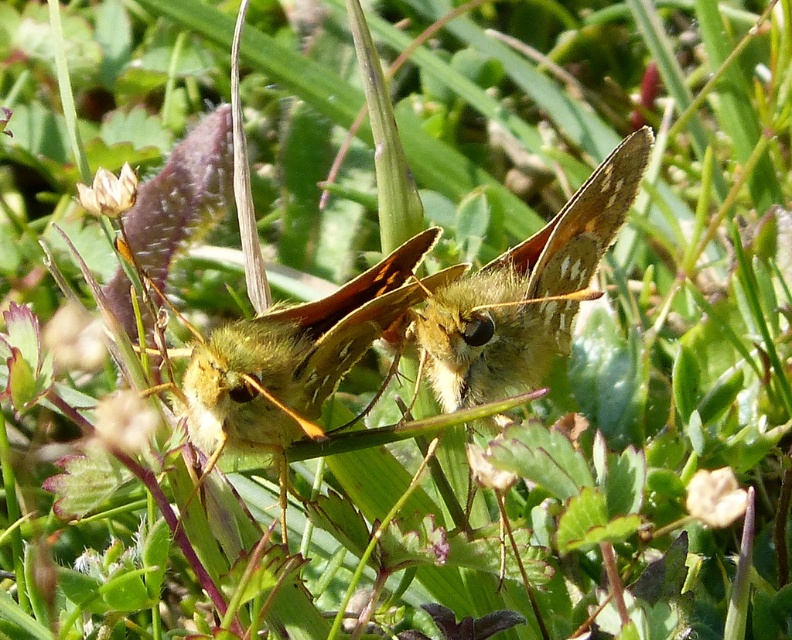
Question: Is fuzzy yellow butterfly at center in front of green fuzzy butterfly at center?

Choices:
 (A) yes
 (B) no

Answer: (A)

Question: Observing the image, what is the correct spatial positioning of fuzzy yellow butterfly at center in reference to green fuzzy butterfly at center?

Choices:
 (A) above
 (B) below

Answer: (A)

Question: Which point appears closest to the camera in this image?

Choices:
 (A) (463, 353)
 (B) (368, 323)

Answer: (B)

Question: Which of the following is the closest to the observer?

Choices:
 (A) fuzzy yellow butterfly at center
 (B) green fuzzy butterfly at center

Answer: (A)

Question: Can you confirm if fuzzy yellow butterfly at center is positioned to the right of green fuzzy butterfly at center?

Choices:
 (A) yes
 (B) no

Answer: (A)

Question: Which object appears closest to the camera in this image?

Choices:
 (A) fuzzy yellow butterfly at center
 (B) green fuzzy butterfly at center

Answer: (A)